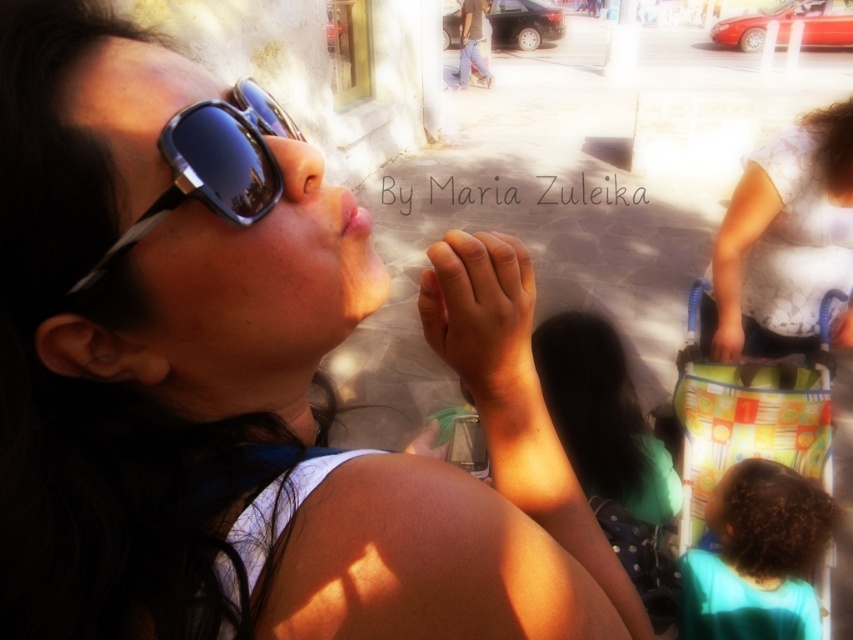
Between point (209, 170) and point (735, 198), which one is positioned in front?

Point (209, 170)

Is shiny black sunglasses at upper left positioned behind smooth plastic bag at lower right?

No, shiny black sunglasses at upper left is closer to the viewer.

Identify the location of shiny black sunglasses at upper left. This screenshot has height=640, width=853. (213, 164).

Who is more distant from viewer, (801,497) or (727,330)?

The point (727,330) is behind.

Is teal fabric shirt at lower right shorter than smooth plastic bag at lower right?

Yes, teal fabric shirt at lower right is shorter than smooth plastic bag at lower right.

Where is `teal fabric shirt at lower right`? teal fabric shirt at lower right is located at coordinates (757, 556).

You are a GUI agent. You are given a task and a screenshot of the screen. Output one action in this format:
    pyautogui.click(x=<x>, y=<y>)
    Task: Click on the teal fabric shirt at lower right
    This screenshot has height=640, width=853.
    Given the screenshot: What is the action you would take?
    pyautogui.click(x=757, y=556)

Can you confirm if teal fabric shirt at lower right is wider than smooth skin hand at center?

Indeed, teal fabric shirt at lower right has a greater width compared to smooth skin hand at center.

Locate an element on the screen. teal fabric shirt at lower right is located at coordinates (757, 556).

The width and height of the screenshot is (853, 640). I want to click on teal fabric shirt at lower right, so click(757, 556).